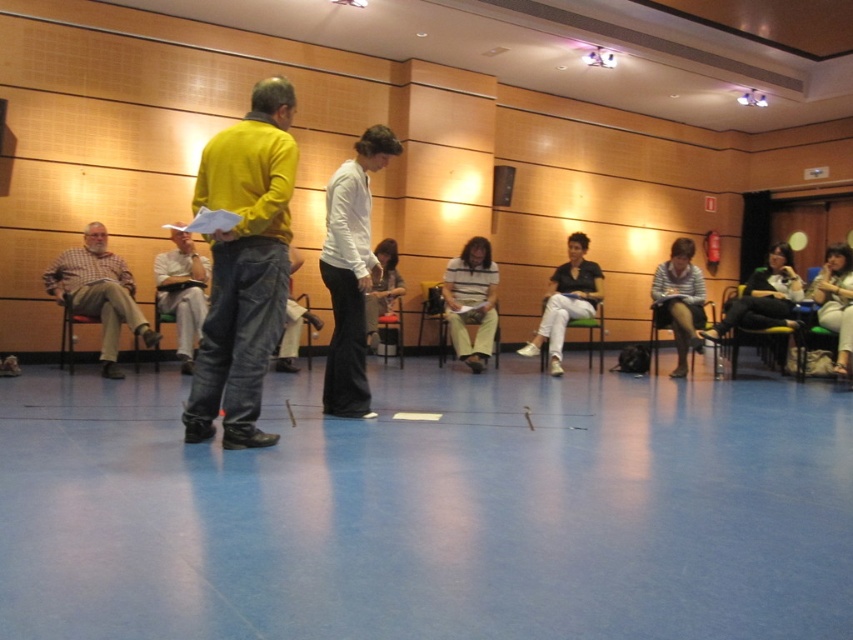
You are a photographer standing in the conference room. You need to take a photo of the jeans at center and the brown fabric chair at left. Based on their heights, which object should you focus on first to ensure both are in frame?

The jeans at center is taller than the brown fabric chair at left, so you should focus on the jeans at center first to ensure both are in frame.

You are standing in the conference room and notice two points marked in the scene. Which point, point (248, 198) or point (112, 369), is closer to your current position?

Point (248, 198) is closer to the camera than point (112, 369), so it is closer to your current position.

You are organizing a photo shoot in this room and need to ensure that all objects are visible. Given that the white smooth shirt at center and the green fabric chair at left are in the frame, which object would require more space to capture in a closeup photo?

The white smooth shirt at center requires more space in a closeup photo because it is larger in size than the green fabric chair at left.